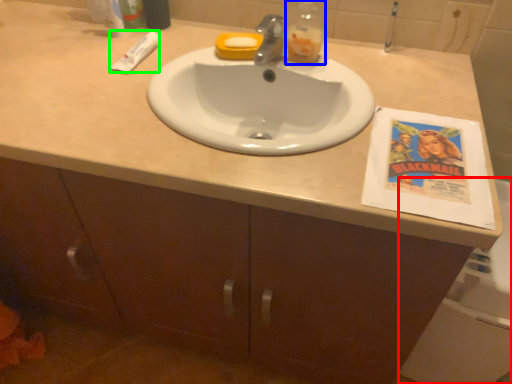
Question: Which is nearer to the bath (highlighted by a red box)? bottle (highlighted by a blue box) or toothpaste (highlighted by a green box).

Choices:
 (A) bottle
 (B) toothpaste

Answer: (A)